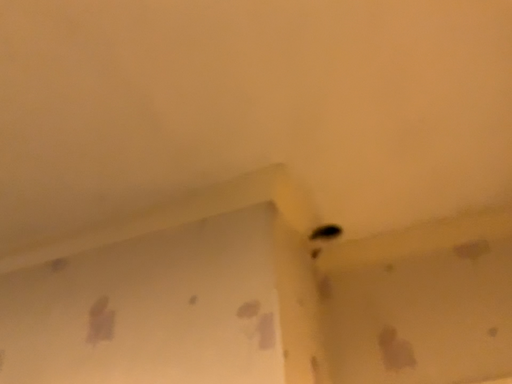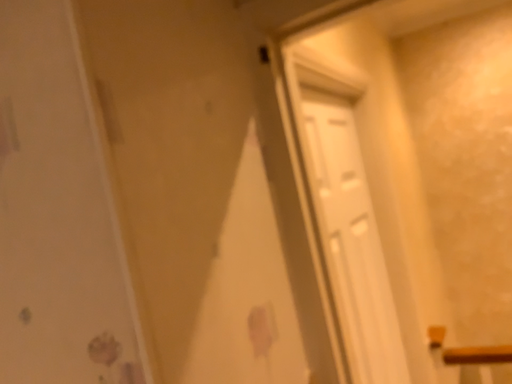
Question: How did the camera likely rotate when shooting the video?

Choices:
 (A) rotated upward
 (B) rotated downward

Answer: (B)